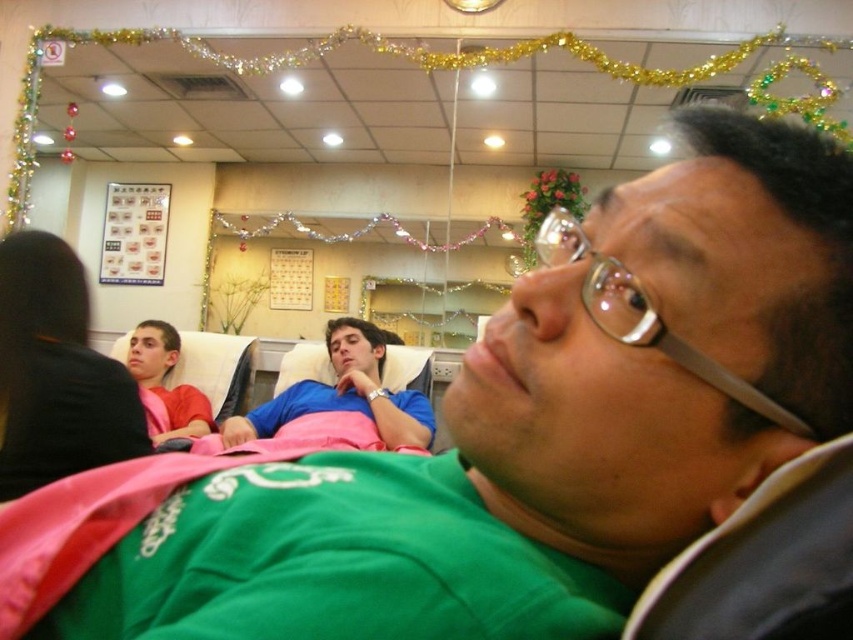
You are a patient in a clinic and you see two shirts hanging on the wall near the entrance. The blue cotton shirt at center and the matte pink shirt at left. Which shirt is bigger?

The blue cotton shirt at center is larger than the matte pink shirt at left.

You are a patient in a dental clinic and notice two pink items on your left side. The first is a pink fabric at left and the second is a matte pink shirt at left. Which of these items is closer to you?

The pink fabric at left is closer to you because it is in front of the matte pink shirt at left.

You are a patient in the clinic and want to locate two specific points in the room. The first point, point 1, is at coordinate point (45, 305), and the second point, point 2, is at coordinate point (410, 424). Which point is closer to you?

Point (45, 305) is closer to the viewer than point (410, 424).